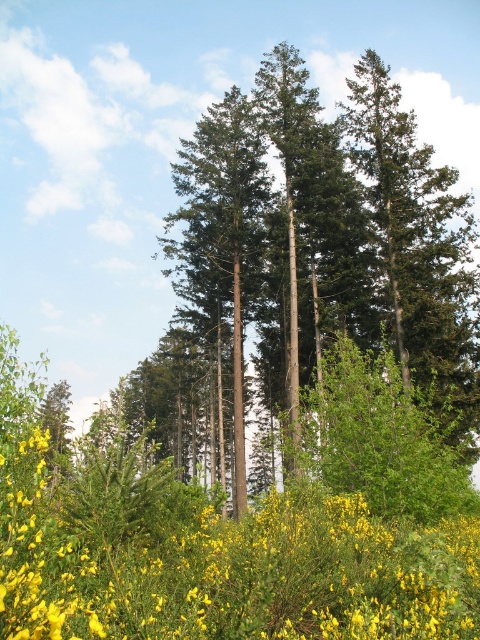
Looking at this image, you are a botanist examining the forest scene. You see the yellow matte flower at center and the green rough bark trees at center. Which object is located to the right of the other?

The yellow matte flower at center is positioned on the right side of green rough bark trees at center.